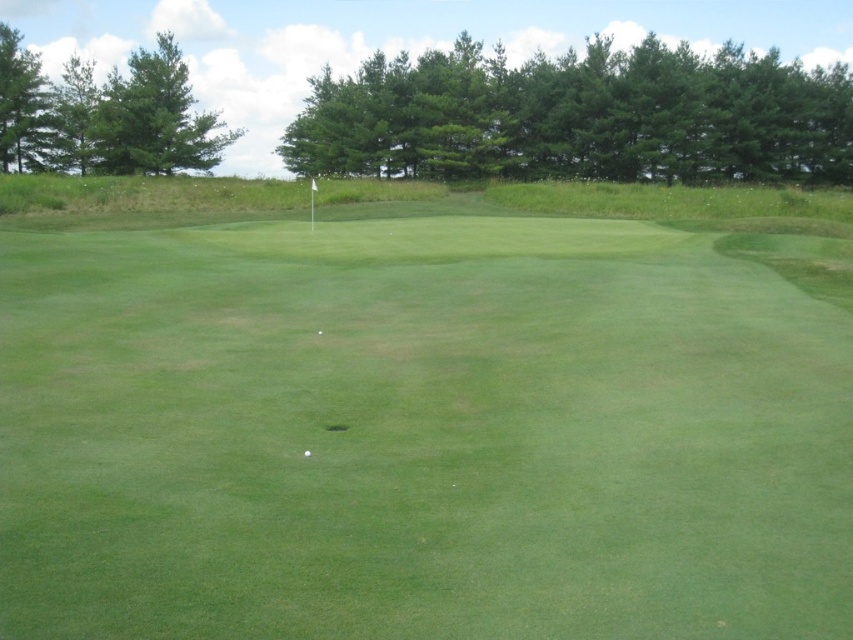
Between green grassy putting green at center and white smooth golf ball at center, which one appears on the right side from the viewer's perspective?

green grassy putting green at center is more to the right.

Is point (662, 262) positioned before point (320, 330)?

No, it is behind (320, 330).

I want to click on green grassy putting green at center, so click(422, 420).

Which is below, green smooth golf ball at center or white smooth golf ball at center?

green smooth golf ball at center is lower down.

Is green smooth golf ball at center closer to camera compared to white smooth golf ball at center?

Yes, green smooth golf ball at center is in front of white smooth golf ball at center.

The height and width of the screenshot is (640, 853). I want to click on green smooth golf ball at center, so click(306, 452).

Between green grassy putting green at center and green smooth golf ball at center, which one appears on the left side from the viewer's perspective?

Positioned to the left is green smooth golf ball at center.

How much distance is there between green grassy putting green at center and green smooth golf ball at center?

A distance of 14.77 meters exists between green grassy putting green at center and green smooth golf ball at center.

Does point (24, 573) come closer to viewer compared to point (306, 452)?

Yes, point (24, 573) is closer to viewer.

Identify the location of green grassy putting green at center. This screenshot has width=853, height=640. point(422,420).